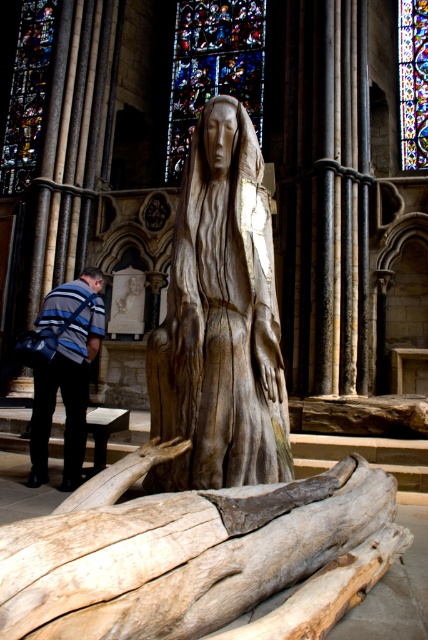
Can you confirm if light brown wood log at lower center is positioned to the left of striped fabric backpack at lower left?

No, light brown wood log at lower center is not to the left of striped fabric backpack at lower left.

Locate an element on the screen. light brown wood log at lower center is located at coordinates (193, 556).

Is point (288, 538) behind point (47, 372)?

No, it is in front of (47, 372).

The height and width of the screenshot is (640, 428). I want to click on light brown wood log at lower center, so click(193, 556).

Does striped fabric backpack at lower left appear on the left side of stained glass at upper center?

Yes, striped fabric backpack at lower left is to the left of stained glass at upper center.

Who is positioned more to the left, striped fabric backpack at lower left or stained glass at upper center?

From the viewer's perspective, striped fabric backpack at lower left appears more on the left side.

Which is behind, point (82, 385) or point (409, 108)?

The point (409, 108) is behind.

Identify the location of striped fabric backpack at lower left. (65, 372).

Who is lower down, striped fabric backpack at lower left or stained glass at upper left?

striped fabric backpack at lower left is below.

Does striped fabric backpack at lower left come behind stained glass at upper left?

That is False.

Who is more distant from viewer, [41,472] or [42,81]?

The point [42,81] is behind.

The width and height of the screenshot is (428, 640). I want to click on striped fabric backpack at lower left, so click(65, 372).